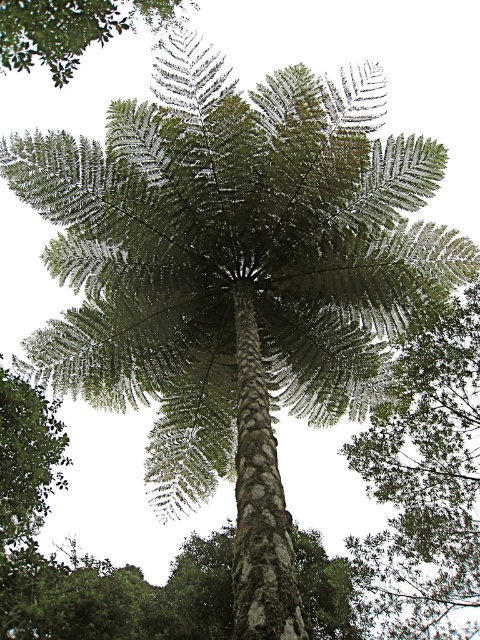
Question: Which point appears closest to the camera in this image?

Choices:
 (A) (429, 577)
 (B) (13, 44)

Answer: (B)

Question: Does green leafy tree at center appear on the right side of green leafy tree at upper left?

Choices:
 (A) yes
 (B) no

Answer: (A)

Question: Considering the relative positions of green leafy tree at center and green leafy tree at upper left in the image provided, where is green leafy tree at center located with respect to green leafy tree at upper left?

Choices:
 (A) above
 (B) below

Answer: (B)

Question: Can you confirm if green leafy tree at center is positioned to the right of green leafy tree at upper left?

Choices:
 (A) no
 (B) yes

Answer: (B)